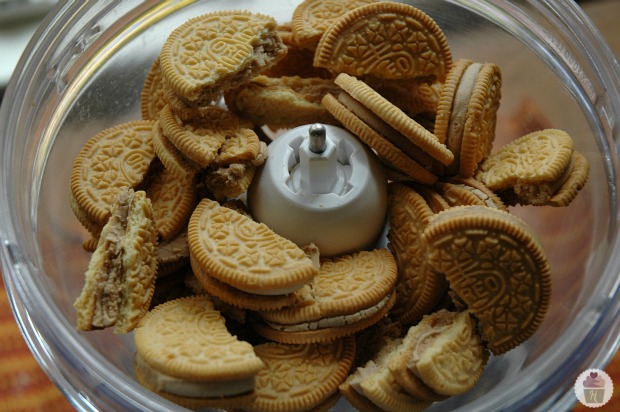
You are a GUI agent. You are given a task and a screenshot of the screen. Output one action in this format:
    pyautogui.click(x=<x>, y=<y>)
    Task: Click on the inside of glass bowl
    The height and width of the screenshot is (412, 620).
    Given the screenshot: What is the action you would take?
    pyautogui.click(x=552, y=104)